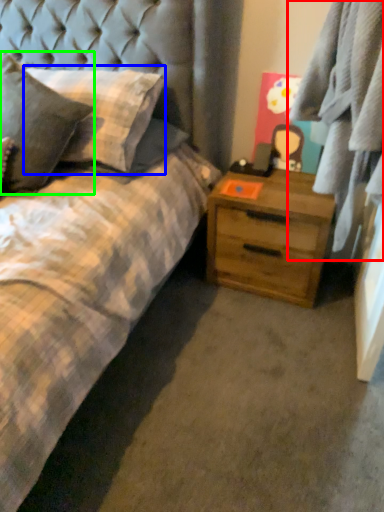
Question: Which object is the closest to the plaid (highlighted by a red box)? Choose among these: pillow (highlighted by a blue box) or pillow (highlighted by a green box).

Choices:
 (A) pillow
 (B) pillow

Answer: (A)